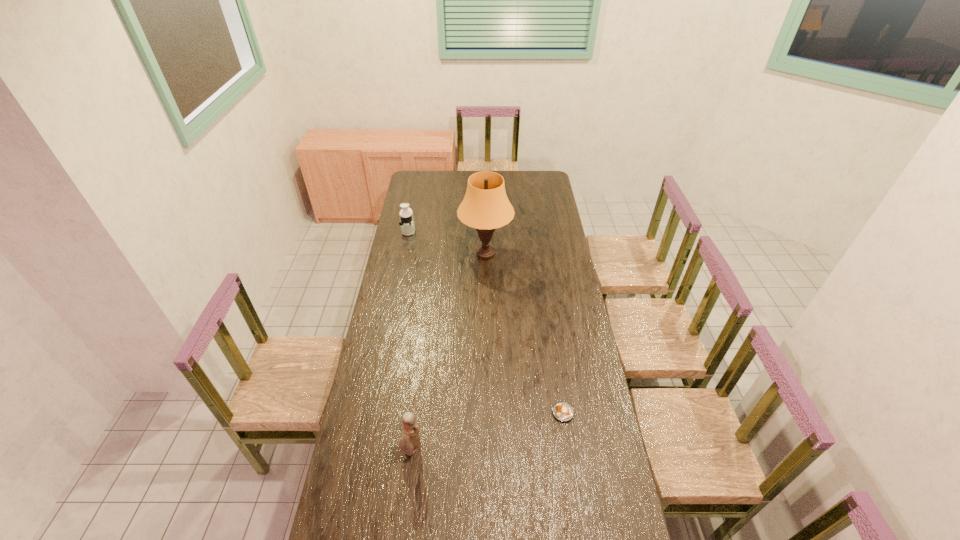
At what (x,y) coordinates should I click in order to perform the action: click on the tallest object. Please return your answer as a coordinate pair (x, y). The width and height of the screenshot is (960, 540). Looking at the image, I should click on (485, 206).

Locate an element on the screen. This screenshot has width=960, height=540. the third nearest object is located at coordinates (485, 206).

I want to click on figurine, so click(x=410, y=441).

At what (x,y) coordinates should I click in order to perform the action: click on the second object from left to right. Please return your answer as a coordinate pair (x, y). Image resolution: width=960 pixels, height=540 pixels. Looking at the image, I should click on (410, 441).

The image size is (960, 540). Identify the location of the third tallest object. (406, 215).

The width and height of the screenshot is (960, 540). Find the location of `the farthest object`. the farthest object is located at coordinates (406, 215).

At what (x,y) coordinates should I click in order to perform the action: click on the shortest object. Please return your answer as a coordinate pair (x, y). Looking at the image, I should click on (562, 411).

At what (x,y) coordinates should I click in order to perform the action: click on the rightmost object. Please return your answer as a coordinate pair (x, y). Image resolution: width=960 pixels, height=540 pixels. Looking at the image, I should click on (562, 411).

Find the location of a particular element. vacant point located 0.120m on the front of the lampshade is located at coordinates (486, 288).

Locate an element on the screen. Image resolution: width=960 pixels, height=540 pixels. vacant area situated 0.090m on the front-facing side of the second object from left to right is located at coordinates (408, 487).